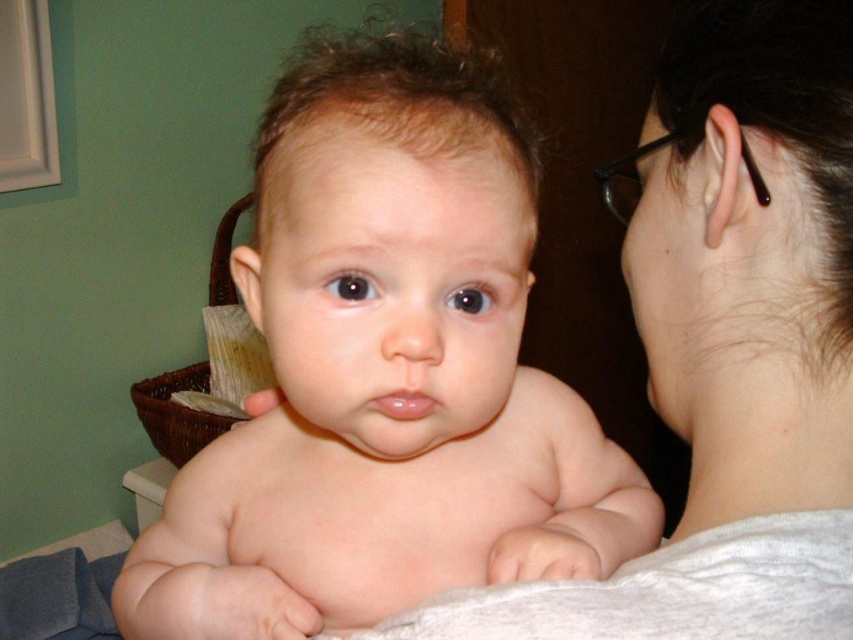
Question: Is smooth skin baby at center wider than white fabric at upper right?

Choices:
 (A) yes
 (B) no

Answer: (A)

Question: Which point is closer to the camera taking this photo?

Choices:
 (A) (616, 540)
 (B) (828, 412)

Answer: (B)

Question: Is smooth skin baby at center to the right of white fabric at upper right from the viewer's perspective?

Choices:
 (A) no
 (B) yes

Answer: (A)

Question: Is smooth skin baby at center positioned behind white fabric at upper right?

Choices:
 (A) no
 (B) yes

Answer: (B)

Question: Among these points, which one is farthest from the camera?

Choices:
 (A) (427, 227)
 (B) (686, 609)

Answer: (A)